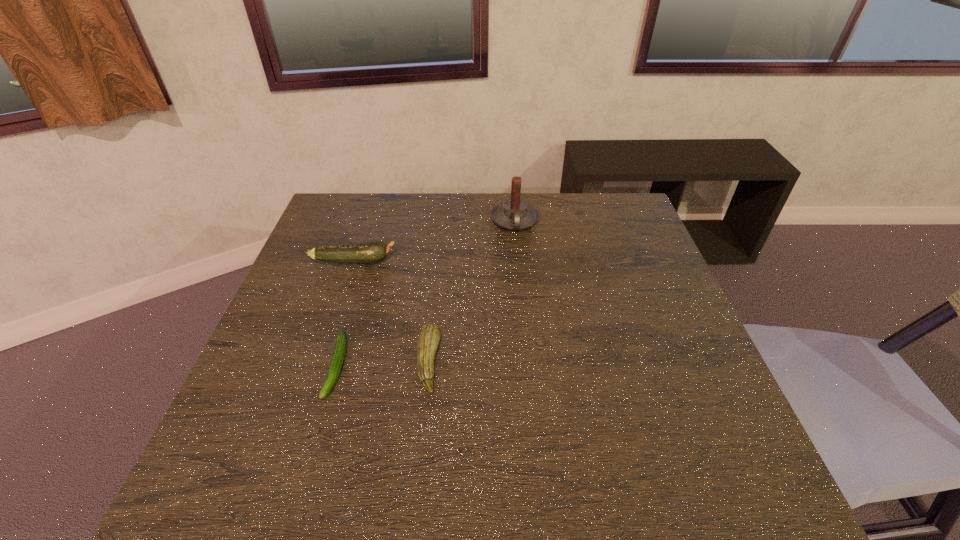
Locate an element on the screen. Image resolution: width=960 pixels, height=540 pixels. free space at the near right corner of the desktop is located at coordinates (694, 498).

Where is `free spot between the candle and the shortest zucchini`? This screenshot has height=540, width=960. free spot between the candle and the shortest zucchini is located at coordinates (426, 294).

Locate an element on the screen. free area in between the second farthest object and the rightmost object is located at coordinates (434, 241).

Where is `vacant area that lies between the second object from right to left and the tallest object`? vacant area that lies between the second object from right to left and the tallest object is located at coordinates (471, 292).

You are a GUI agent. You are given a task and a screenshot of the screen. Output one action in this format:
    pyautogui.click(x=<x>, y=<y>)
    Task: Click on the free space between the candle and the second tallest zucchini
    The width and height of the screenshot is (960, 540).
    Given the screenshot: What is the action you would take?
    pyautogui.click(x=471, y=292)

Identify the location of empty space that is in between the tallest zucchini and the shortest object. This screenshot has height=540, width=960. (346, 313).

This screenshot has width=960, height=540. I want to click on blank region between the third shortest object and the tallest object, so click(x=434, y=241).

The height and width of the screenshot is (540, 960). What are the coordinates of `free space that is in between the tallest object and the shortest zucchini` in the screenshot? It's located at (426, 294).

Where is `vacant region between the shortest zucchini and the candle`? This screenshot has height=540, width=960. vacant region between the shortest zucchini and the candle is located at coordinates (426, 294).

Where is `vacant space that's between the tallest object and the shortest zucchini`? This screenshot has width=960, height=540. vacant space that's between the tallest object and the shortest zucchini is located at coordinates (426, 294).